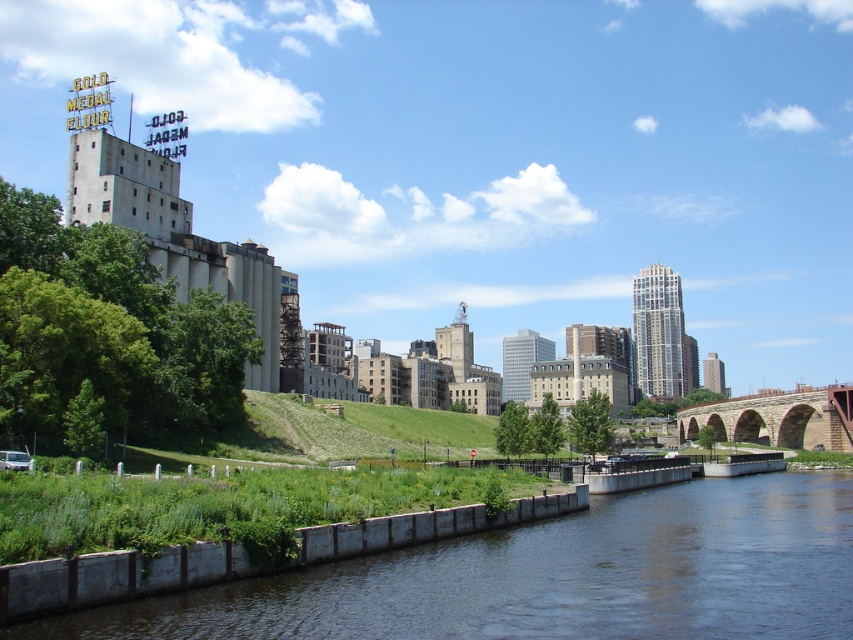
You are standing at the point labeled as point (553, 577) in the image. What is the closest object to you in the scene?

The closest object to you at point (553, 577) is the dark gray concrete wall at lower center, as the point directly indicates its location.

You are a painter standing at the edge of the river and want to paint both the dark gray concrete wall at lower center and the brown stone bridge at lower right. Which object should you focus on first if you want to paint the taller one first?

The brown stone bridge at lower right is taller than the dark gray concrete wall at lower center, so you should focus on painting the brown stone bridge at lower right first.